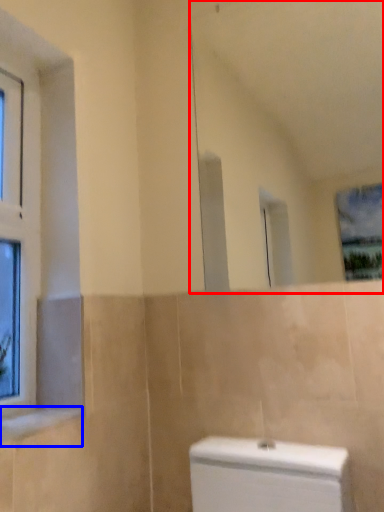
Question: Among these objects, which one is nearest to the camera, mirror (highlighted by a red box) or window sill (highlighted by a blue box)?

Choices:
 (A) mirror
 (B) window sill

Answer: (B)